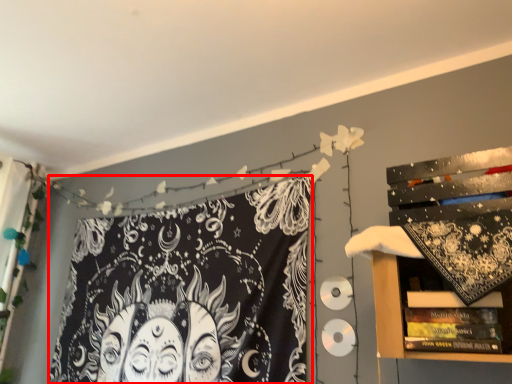
Question: In this image, where is fabric (annotated by the red box) located relative to shelf?

Choices:
 (A) right
 (B) left

Answer: (B)